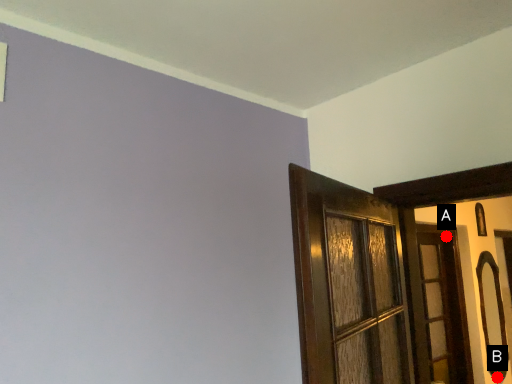
Question: Two points are circled on the image, labeled by A and B beside each circle. Which point is closer to the camera?

Choices:
 (A) A is closer
 (B) B is closer

Answer: (A)